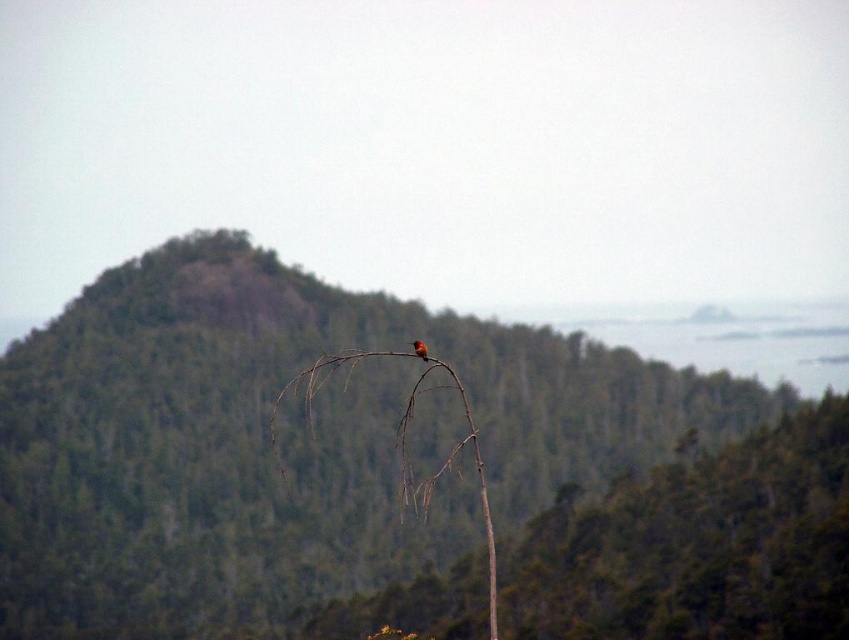
Question: Which object is the closest to the brown wood branch at center?

Choices:
 (A) bright orange bird at center
 (B) green textured mountain at center
 (C) brown wood tree at center

Answer: (B)

Question: Which object appears farthest from the camera in this image?

Choices:
 (A) brown wood branch at center
 (B) bright orange bird at center
 (C) green textured mountain at center
 (D) brown wood tree at center

Answer: (B)

Question: Among these points, which one is nearest to the camera?

Choices:
 (A) (415, 346)
 (B) (178, 577)
 (C) (459, 600)

Answer: (A)

Question: Does brown wood tree at center appear on the left side of bright orange bird at center?

Choices:
 (A) yes
 (B) no

Answer: (B)

Question: Does brown wood tree at center come in front of brown wood branch at center?

Choices:
 (A) yes
 (B) no

Answer: (B)

Question: Can you confirm if green textured mountain at center is positioned to the left of brown wood branch at center?

Choices:
 (A) no
 (B) yes

Answer: (A)